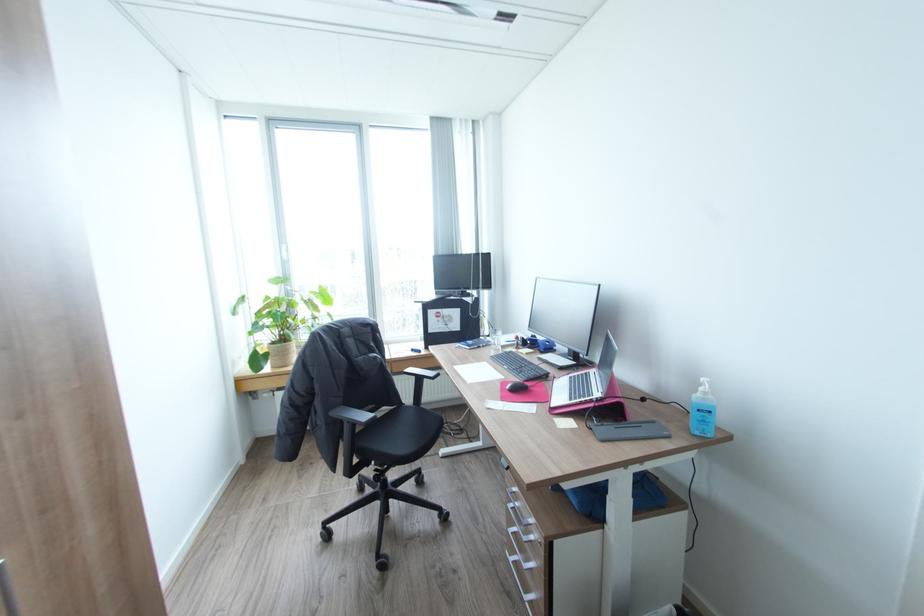
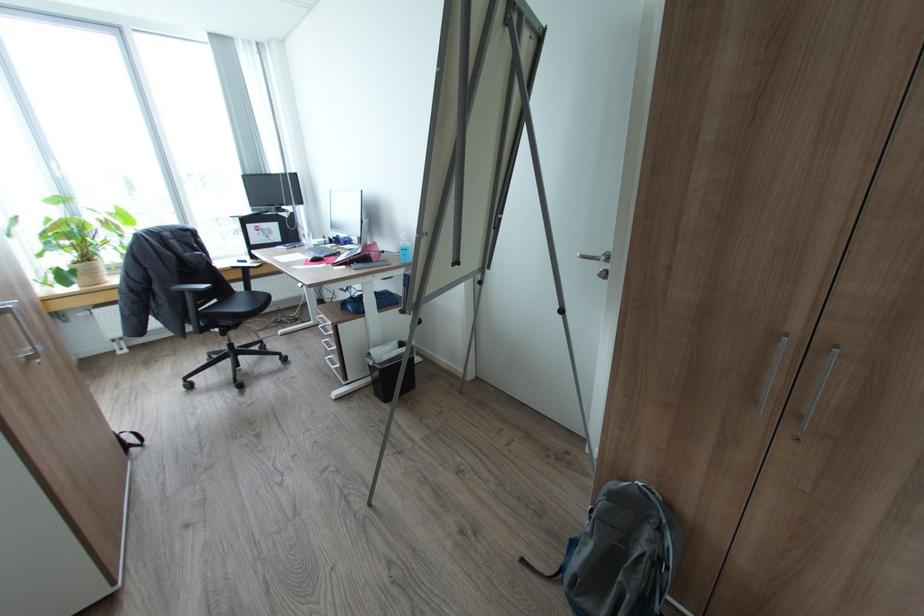
Locate, in the second image, the point that corresponds to point (513, 387) in the first image.

(314, 259)